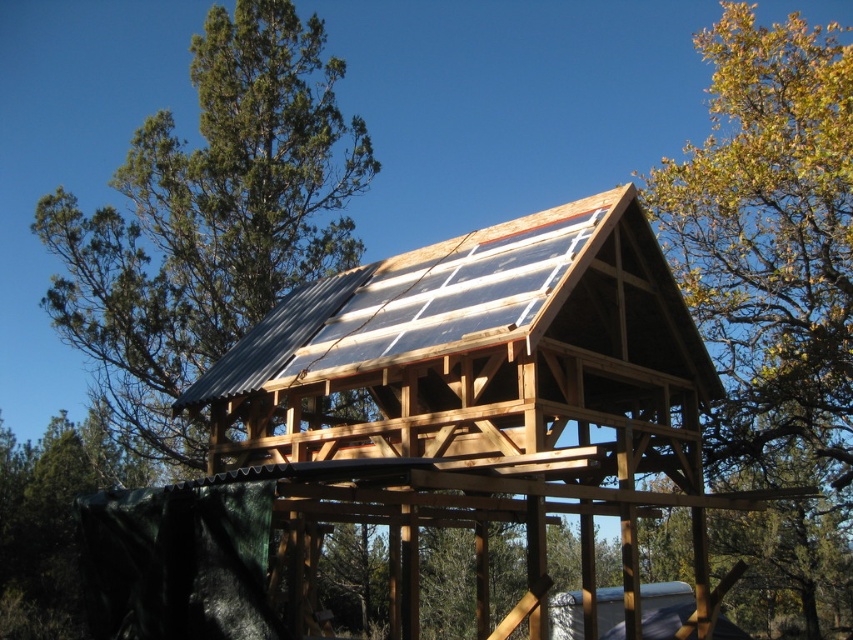
Question: Is metallic silver solar panel at center above green leafy tree at upper right?

Choices:
 (A) yes
 (B) no

Answer: (B)

Question: Based on their relative distances, which object is nearer to the green leafy tree at upper left?

Choices:
 (A) green leafy tree at upper right
 (B) metallic silver solar panel at center

Answer: (B)

Question: Which object is closer to the camera taking this photo?

Choices:
 (A) metallic silver solar panel at center
 (B) green leafy tree at upper left
 (C) green leafy tree at upper right

Answer: (A)

Question: Is green leafy tree at upper right closer to camera compared to green leafy tree at upper left?

Choices:
 (A) no
 (B) yes

Answer: (B)

Question: Is green leafy tree at upper right smaller than green leafy tree at upper left?

Choices:
 (A) yes
 (B) no

Answer: (B)

Question: Which of the following is the closest to the observer?

Choices:
 (A) (642, 310)
 (B) (811, 106)
 (C) (339, 262)

Answer: (A)